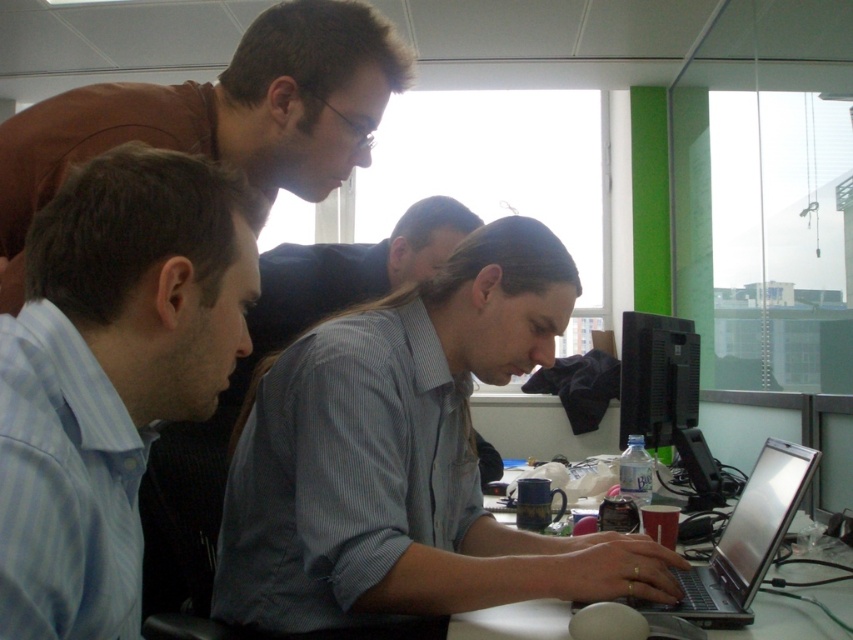
Which is in front, point (47, 445) or point (836, 609)?

Point (47, 445) is more forward.

Is light blue striped shirt at left to the left of white plastic table at center from the viewer's perspective?

Yes, light blue striped shirt at left is to the left of white plastic table at center.

This screenshot has width=853, height=640. I want to click on light blue striped shirt at left, so click(x=112, y=374).

Identify the location of light blue striped shirt at left. (112, 374).

Between silver metallic laptop at center and black glossy monitor at right, which one appears on the left side from the viewer's perspective?

silver metallic laptop at center

At what (x,y) coordinates should I click in order to perform the action: click on silver metallic laptop at center. Please return your answer as a coordinate pair (x, y). Looking at the image, I should click on [x=744, y=540].

You are a GUI agent. You are given a task and a screenshot of the screen. Output one action in this format:
    pyautogui.click(x=<x>, y=<y>)
    Task: Click on the silver metallic laptop at center
    
    Given the screenshot: What is the action you would take?
    pyautogui.click(x=744, y=540)

Is brown matte shirt at upper left to the left of silver metallic laptop at center from the viewer's perspective?

Correct, you'll find brown matte shirt at upper left to the left of silver metallic laptop at center.

Does brown matte shirt at upper left appear under silver metallic laptop at center?

No, brown matte shirt at upper left is not below silver metallic laptop at center.

Is point (9, 161) positioned in front of point (747, 557)?

Yes, point (9, 161) is closer to viewer.

Find the location of a particular element. The image size is (853, 640). brown matte shirt at upper left is located at coordinates (219, 116).